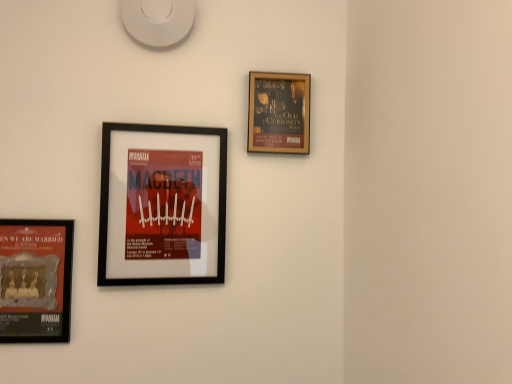
Question: Considering the relative positions of matte black poster at lower left, which is the first picture frame from left to right, and gold-framed poster at upper right, which appears as the third picture frame when viewed from the left, in the image provided, is matte black poster at lower left, which is the first picture frame from left to right, to the right of gold-framed poster at upper right, which appears as the third picture frame when viewed from the left, from the viewer's perspective?

Choices:
 (A) no
 (B) yes

Answer: (A)

Question: Could you tell me if matte black poster at lower left, which is counted as the third picture frame, starting from the right, is turned towards gold-framed poster at upper right, which appears as the first picture frame when viewed from the right?

Choices:
 (A) no
 (B) yes

Answer: (A)

Question: Is matte black poster at lower left, which is the first picture frame from left to right, not near gold-framed poster at upper right, which appears as the first picture frame when viewed from the right?

Choices:
 (A) no
 (B) yes

Answer: (A)

Question: Is the depth of matte black poster at lower left, which is counted as the third picture frame, starting from the right, greater than that of gold-framed poster at upper right, which appears as the first picture frame when viewed from the right?

Choices:
 (A) yes
 (B) no

Answer: (B)

Question: Is matte black poster at lower left, which is counted as the third picture frame, starting from the right, shorter than gold-framed poster at upper right, which appears as the third picture frame when viewed from the left?

Choices:
 (A) yes
 (B) no

Answer: (B)

Question: Does point (170, 281) appear closer or farther from the camera than point (12, 238)?

Choices:
 (A) farther
 (B) closer

Answer: (A)

Question: Do you think black matte picture frame at center-left, which is the 2th picture frame in right-to-left order, is within matte black poster at lower left, which is counted as the third picture frame, starting from the right, or outside of it?

Choices:
 (A) inside
 (B) outside

Answer: (B)

Question: Is black matte picture frame at center-left, placed as the second picture frame when sorted from left to right, wider or thinner than matte black poster at lower left, which is the first picture frame from left to right?

Choices:
 (A) wide
 (B) thin

Answer: (A)

Question: In terms of height, does black matte picture frame at center-left, placed as the second picture frame when sorted from left to right, look taller or shorter compared to matte black poster at lower left, which is counted as the third picture frame, starting from the right?

Choices:
 (A) short
 (B) tall

Answer: (B)

Question: Considering the positions of point (28, 322) and point (295, 117), is point (28, 322) closer or farther from the camera than point (295, 117)?

Choices:
 (A) farther
 (B) closer

Answer: (B)

Question: From the image's perspective, relative to gold-framed poster at upper right, which appears as the first picture frame when viewed from the right, is matte black poster at lower left, which is counted as the third picture frame, starting from the right, above or below?

Choices:
 (A) above
 (B) below

Answer: (B)

Question: Looking at their shapes, would you say matte black poster at lower left, which is the first picture frame from left to right, is wider or thinner than gold-framed poster at upper right, which appears as the third picture frame when viewed from the left?

Choices:
 (A) wide
 (B) thin

Answer: (B)

Question: Is matte black poster at lower left, which is counted as the third picture frame, starting from the right, situated inside gold-framed poster at upper right, which appears as the first picture frame when viewed from the right, or outside?

Choices:
 (A) outside
 (B) inside

Answer: (A)

Question: Does point (48, 334) appear closer or farther from the camera than point (180, 276)?

Choices:
 (A) closer
 (B) farther

Answer: (A)

Question: Choose the correct answer: Is matte black poster at lower left, which is the first picture frame from left to right, inside black matte picture frame at center-left, which is the 2th picture frame in right-to-left order, or outside it?

Choices:
 (A) outside
 (B) inside

Answer: (A)